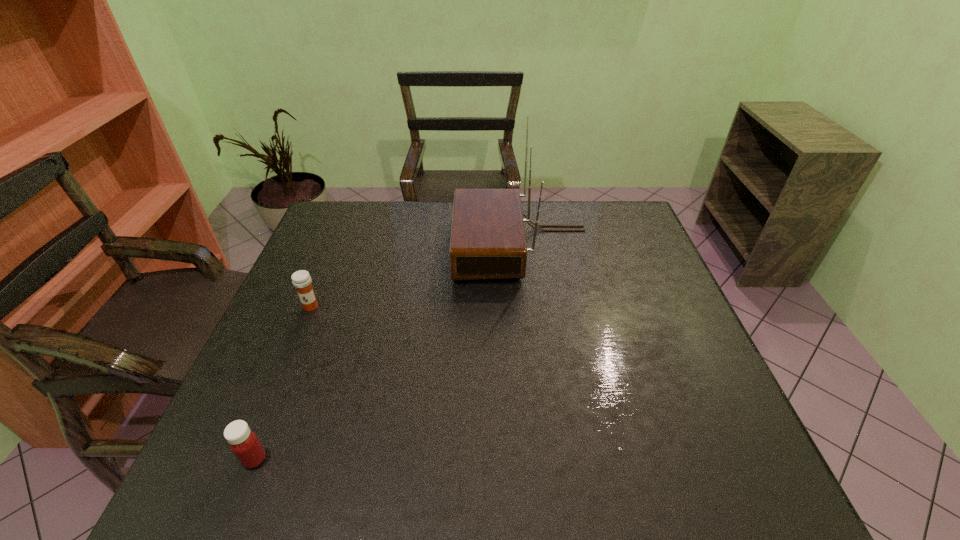
I want to click on the tallest object, so click(488, 241).

This screenshot has height=540, width=960. I want to click on the rightmost object, so click(488, 241).

Locate an element on the screen. the farther medicine is located at coordinates (301, 279).

Where is `the nearer medicine`? This screenshot has width=960, height=540. the nearer medicine is located at coordinates (244, 443).

Locate an element on the screen. vacant space positioned 0.120m on the front panel of the rightmost object is located at coordinates (416, 246).

Find the location of a particular element. vacant space situated 0.230m on the front panel of the rightmost object is located at coordinates (380, 246).

I want to click on vacant region located on the front panel of the rightmost object, so click(x=425, y=246).

Identify the location of vacant space located 0.300m on the label side of the second farthest object. Image resolution: width=960 pixels, height=540 pixels. (266, 415).

What are the coordinates of `free space located on the front of the nearest object` in the screenshot? It's located at (237, 503).

Identify the location of object that is at the far edge. The height and width of the screenshot is (540, 960). (488, 241).